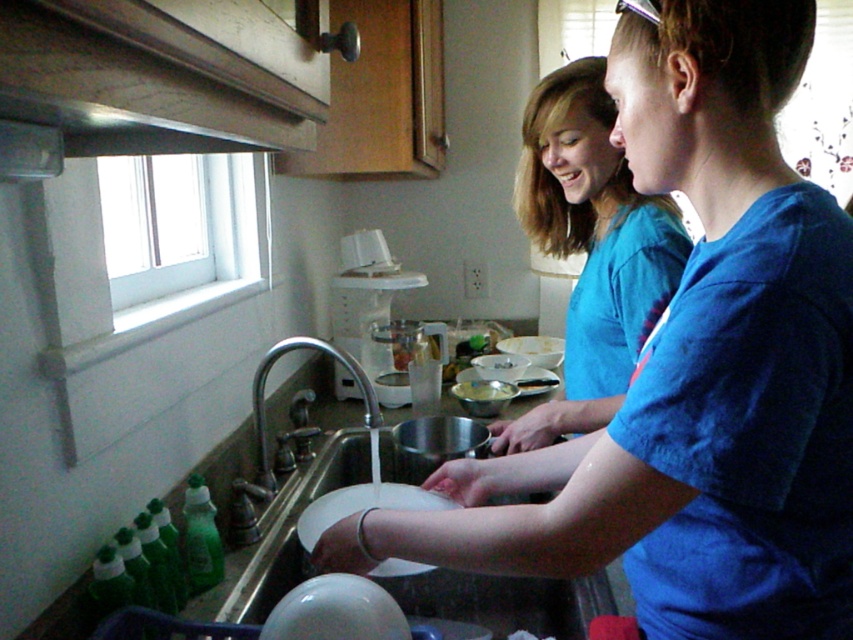
You are organizing a laundry day and need to know which blue cotton shirt is larger in width. You see the blue cotton shirt at upper right and the blue cotton shirt at center. Which one is wider?

The blue cotton shirt at upper right might be wider than blue cotton shirt at center.